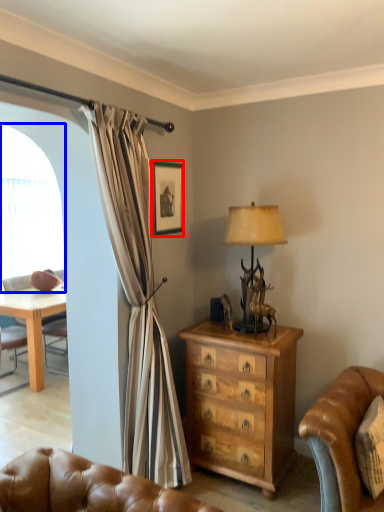
Question: Which object appears farthest to the camera in this image, picture frame (highlighted by a red box) or window screen (highlighted by a blue box)?

Choices:
 (A) picture frame
 (B) window screen

Answer: (B)